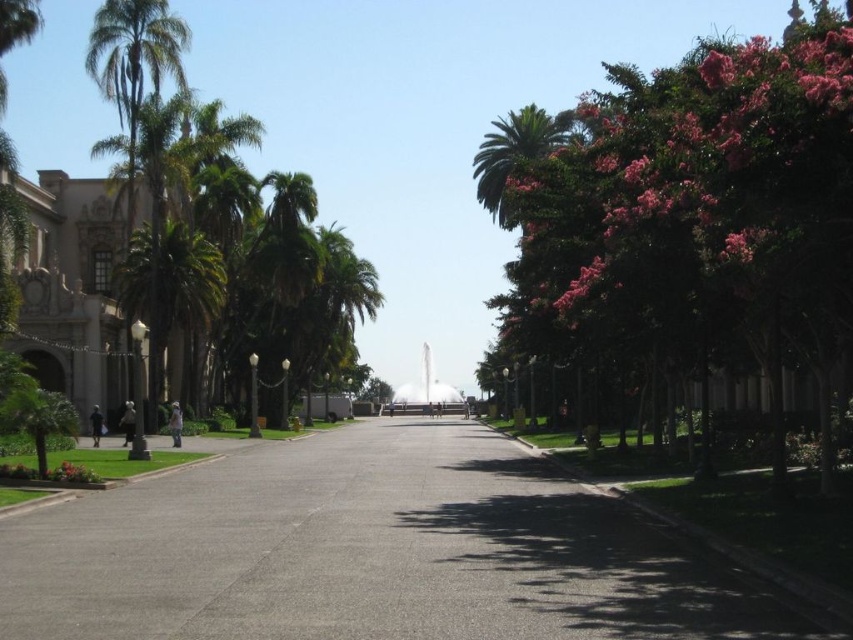
You are standing in the plaza and want to take a photo of both the green leafy tree at right and the green leafy palm tree at left. Which tree should you focus on first to ensure both are in the frame?

You should focus on the green leafy palm tree at left first because it is farther away from you than the green leafy tree at right, allowing both to be in the frame when properly composed.

You are planning to install a new lighting fixture in the plaza. The fixture requires being placed under a tree that is taller than the other trees in the area. Which tree should you choose between the green leafy tree at right and the green leafy palm tree at left?

The green leafy tree at right is much taller than the green leafy palm tree at left, so you should choose the green leafy tree at right for installing the lighting fixture.

You are standing at the center of the plaza and want to take a photo of the green leafy tree at right. Which direction should you face to capture it in your shot?

Since the green leafy tree at right is positioned at point 0.350 on the x and 0.807 on the y, you should face towards the right side of the plaza to capture it in your shot.